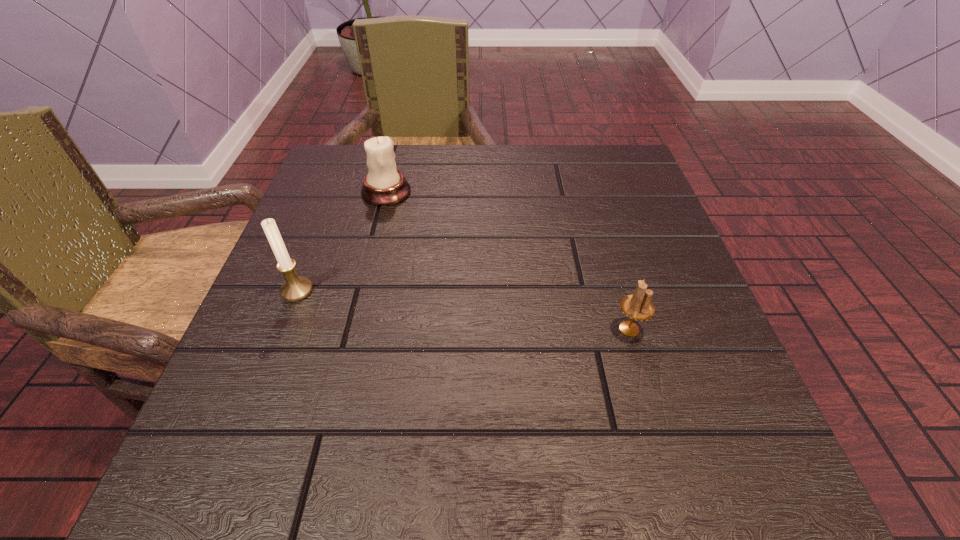
Find the location of a particular element. Image resolution: width=960 pixels, height=540 pixels. candle holder that is the second closest to the leftmost candle holder is located at coordinates (638, 306).

Locate an element on the screen. This screenshot has height=540, width=960. the closest candle holder to the second candle holder from left to right is located at coordinates (295, 288).

I want to click on vacant space that satisfies the following two spatial constraints: 1. on the front side of the second farthest candle holder; 2. on the left side of the rightmost candle holder, so [x=282, y=329].

Find the location of a particular element. This screenshot has height=540, width=960. free space that satisfies the following two spatial constraints: 1. on the front side of the rightmost object; 2. on the left side of the second farthest object is located at coordinates (282, 329).

Find the location of a particular element. vacant position in the image that satisfies the following two spatial constraints: 1. on the front side of the leftmost object; 2. on the right side of the rightmost object is located at coordinates (x=282, y=329).

This screenshot has height=540, width=960. I want to click on blank space that satisfies the following two spatial constraints: 1. on the front side of the farthest candle holder; 2. on the left side of the rightmost candle holder, so click(352, 329).

The width and height of the screenshot is (960, 540). What are the coordinates of `free space that satisfies the following two spatial constraints: 1. on the front side of the second candle holder from left to right; 2. on the left side of the nearest candle holder` in the screenshot? It's located at (352, 329).